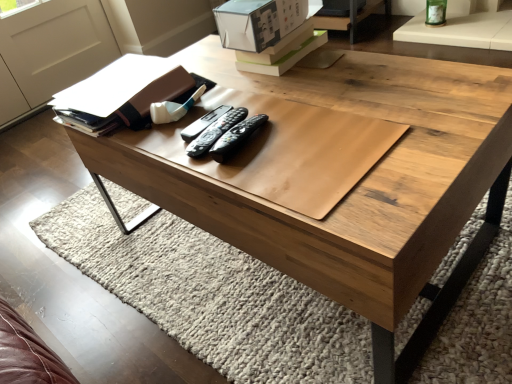
Locate an element on the screen. The height and width of the screenshot is (384, 512). free point behind black plastic remote at center, acting as the 1th remote starting from the right is located at coordinates pyautogui.click(x=260, y=98).